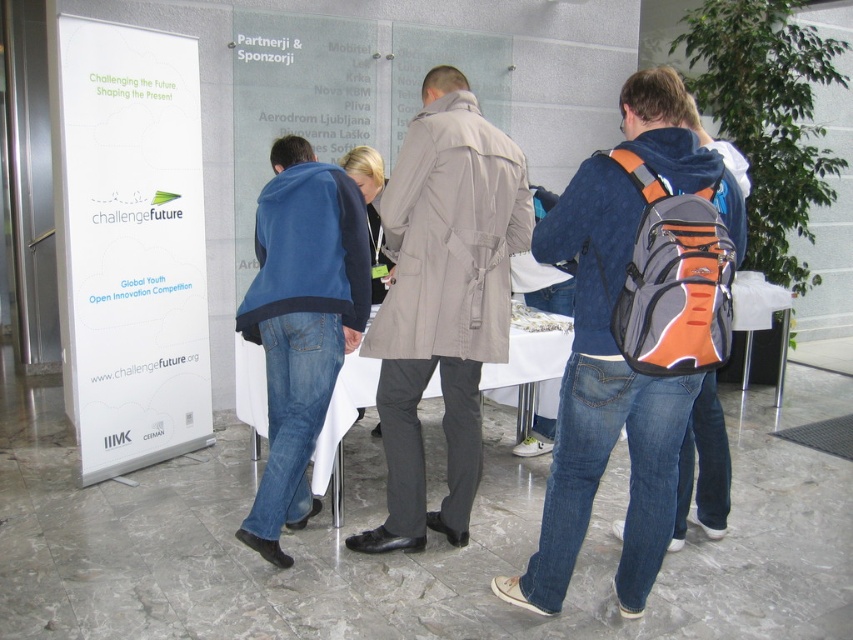
Question: Estimate the real-world distances between objects in this image. Which object is closer to the orange and gray backpack at center?

Choices:
 (A) blue fleece jacket at center
 (B) white paperboard at left
 (C) light beige fabric trench coat at center
 (D) white cloth at center

Answer: (C)

Question: Which of these objects is positioned closest to the light beige fabric trench coat at center?

Choices:
 (A) white paperboard at left
 (B) white cloth at center

Answer: (B)

Question: Does blue fleece jacket at center have a smaller size compared to white cloth at center?

Choices:
 (A) yes
 (B) no

Answer: (A)

Question: Where is orange and gray backpack at center located in relation to blue fleece jacket at center in the image?

Choices:
 (A) below
 (B) above

Answer: (A)

Question: Which of the following is the farthest from the observer?

Choices:
 (A) (506, 305)
 (B) (523, 339)
 (C) (544, 600)
 (D) (283, 362)

Answer: (B)

Question: Does white paperboard at left appear on the right side of light beige fabric trench coat at center?

Choices:
 (A) yes
 (B) no

Answer: (B)